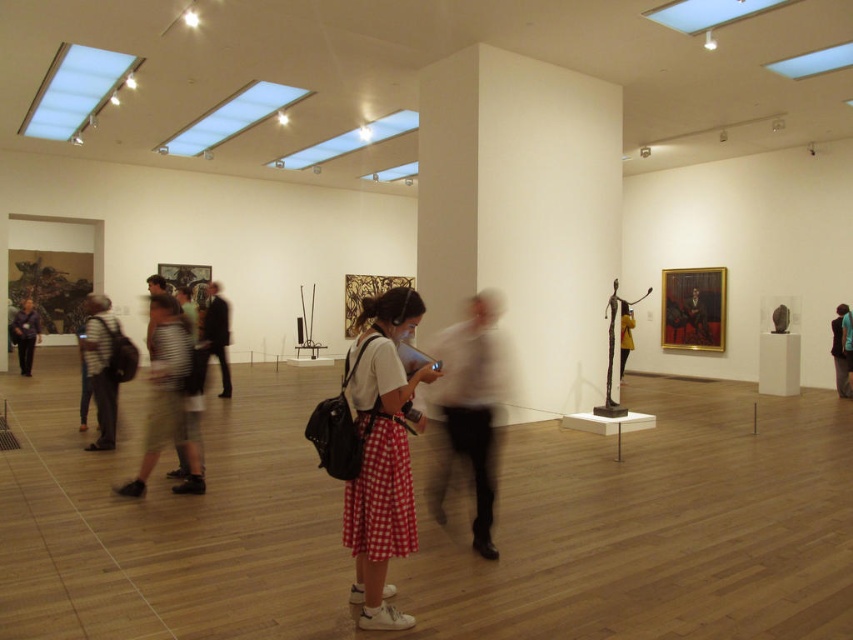
Who is higher up, white matte shirt at center or khaki shorts at left?

khaki shorts at left is higher up.

Does white matte shirt at center have a lesser height compared to khaki shorts at left?

In fact, white matte shirt at center may be taller than khaki shorts at left.

Where is `white matte shirt at center`? white matte shirt at center is located at coordinates (469, 412).

Can you confirm if khaki shorts at left is shorter than matte black statue at center?

Incorrect, khaki shorts at left's height does not fall short of matte black statue at center's.

Who is positioned more to the right, khaki shorts at left or matte black statue at center?

matte black statue at center

Between point (137, 490) and point (624, 339), which one is positioned behind?

Point (624, 339)

The image size is (853, 640). I want to click on khaki shorts at left, so click(x=167, y=397).

Can you confirm if blue denim jacket at lower right is taller than matte black statue at center?

Indeed, blue denim jacket at lower right has a greater height compared to matte black statue at center.

Is point (840, 358) farther from viewer compared to point (622, 305)?

Yes.

This screenshot has width=853, height=640. I want to click on blue denim jacket at lower right, so click(839, 353).